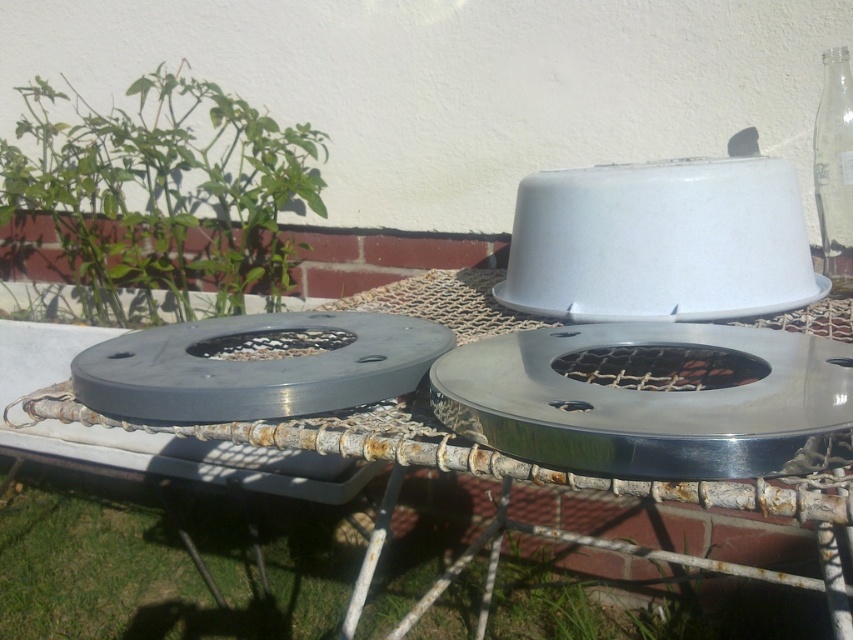
Does green grass at lower left have a greater height compared to transparent glass bottle at upper right?

No, green grass at lower left is not taller than transparent glass bottle at upper right.

Which is below, green grass at lower left or transparent glass bottle at upper right?

green grass at lower left is below.

Does point (83, 570) come in front of point (822, 124)?

No.

In order to click on green grass at lower left in this screenshot , I will do (161, 568).

Is point (405, 589) positioned after point (836, 404)?

That is True.

Does green grass at lower left lie behind satin silver grill at center?

Yes, green grass at lower left is behind satin silver grill at center.

Identify the location of green grass at lower left. (161, 568).

Does satin silver grill at center lie behind matte gray grill at center?

No, it is in front of matte gray grill at center.

Is point (651, 445) positioned after point (358, 352)?

No, (651, 445) is closer to viewer.

Is point (747, 460) closer to viewer compared to point (277, 340)?

Yes.

You are a GUI agent. You are given a task and a screenshot of the screen. Output one action in this format:
    pyautogui.click(x=<x>, y=<y>)
    Task: Click on the satin silver grill at center
    The image size is (853, 640).
    Given the screenshot: What is the action you would take?
    (653, 400)